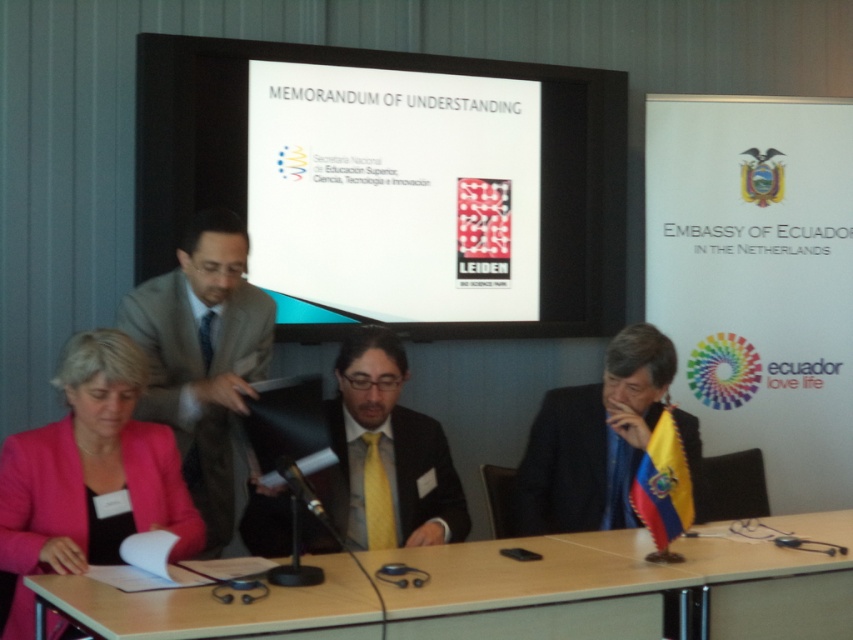
Question: Which point is farther from the camera taking this photo?

Choices:
 (A) (552, 506)
 (B) (84, 365)

Answer: (A)

Question: Does light gray wool suit at left appear on the left side of matte black suit at center?

Choices:
 (A) no
 (B) yes

Answer: (B)

Question: Does wooden table at lower center have a greater width compared to black matte suit at center?

Choices:
 (A) no
 (B) yes

Answer: (B)

Question: Which point is closer to the camera taking this photo?

Choices:
 (A) (76, 604)
 (B) (573, 268)
 (C) (596, 481)

Answer: (A)

Question: Does white glossy projection screen at upper center appear under light gray wool suit at left?

Choices:
 (A) no
 (B) yes

Answer: (A)

Question: Which of the following is the closest to the observer?

Choices:
 (A) black matte suit at center
 (B) light gray wool suit at left

Answer: (B)